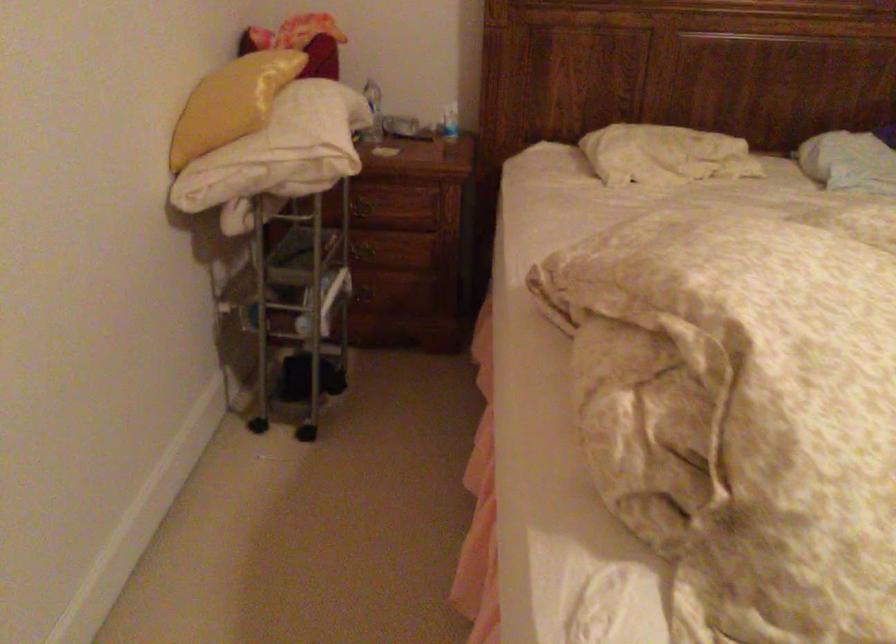
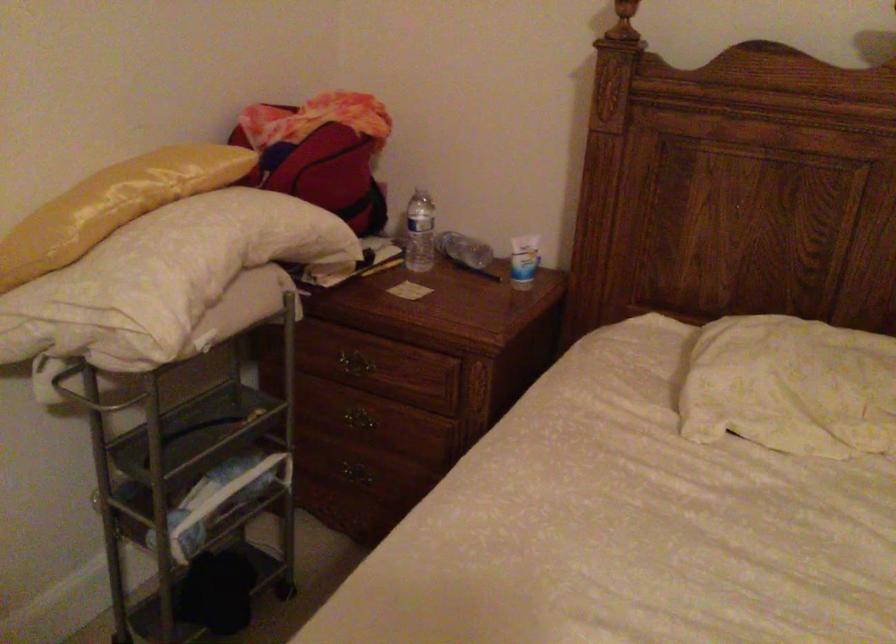
Find the pixel in the second image that matches the point at 360,212 in the first image.

(350, 365)